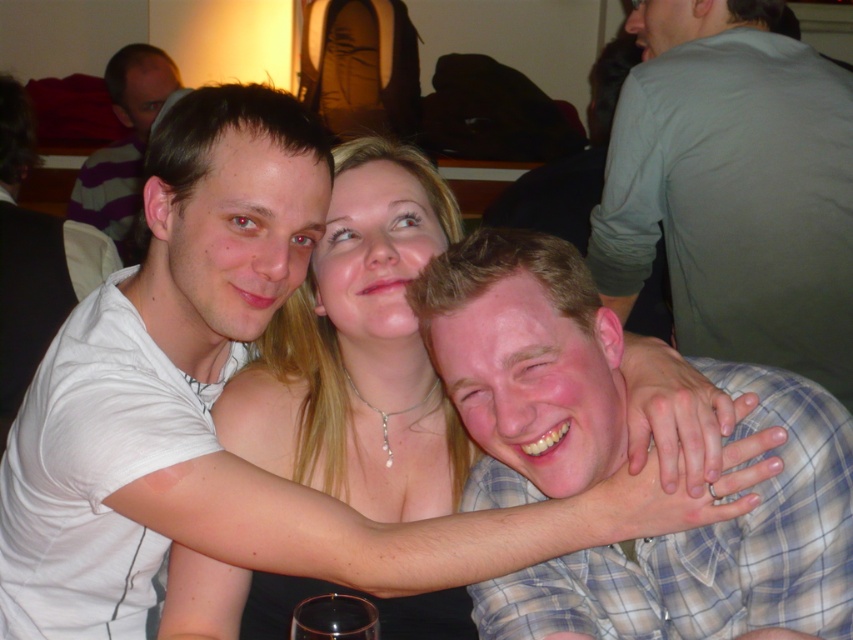
Question: Can you confirm if light brown plaid shirt at center is bigger than gray fabric shirt at upper right?

Choices:
 (A) yes
 (B) no

Answer: (B)

Question: Which object is positioned closest to the gray fabric shirt at upper right?

Choices:
 (A) green cotton shirt at right
 (B) matte white shirt at left
 (C) light brown plaid shirt at center

Answer: (A)

Question: Which object is farther from the camera taking this photo?

Choices:
 (A) matte white shirt at left
 (B) light brown plaid shirt at center
 (C) gray fabric shirt at upper right
 (D) green cotton shirt at right

Answer: (A)

Question: Can you confirm if light brown plaid shirt at center is smaller than gray fabric shirt at upper right?

Choices:
 (A) yes
 (B) no

Answer: (A)

Question: Is green cotton shirt at right in front of matte white shirt at left?

Choices:
 (A) no
 (B) yes

Answer: (B)

Question: Which object appears closest to the camera in this image?

Choices:
 (A) matte white shirt at left
 (B) gray fabric shirt at upper right
 (C) light brown plaid shirt at center

Answer: (C)